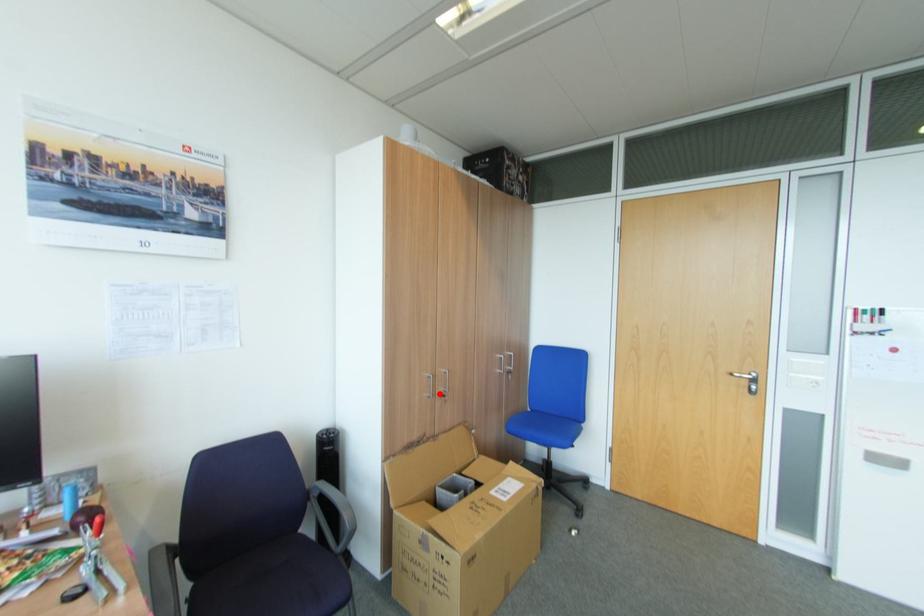
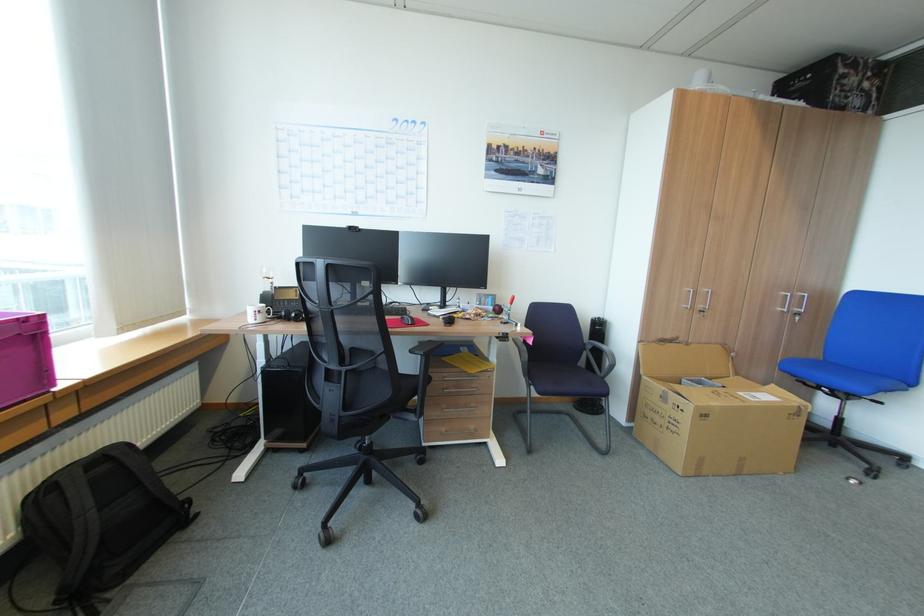
The point at the highlighted location is marked in the first image. Where is the corresponding point in the second image?

(698, 307)